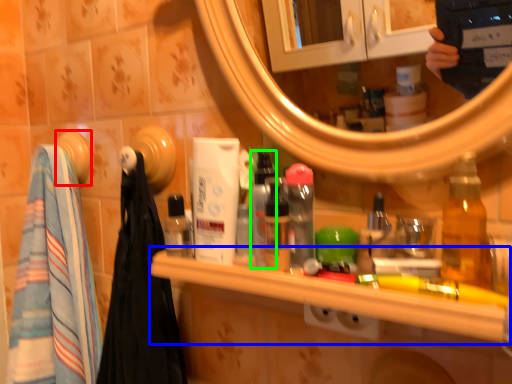
Question: Based on their relative distances, which object is farther from towel bar (highlighted by a red box)? Choose from counter (highlighted by a blue box) and bottle (highlighted by a green box).

Choices:
 (A) counter
 (B) bottle

Answer: (A)